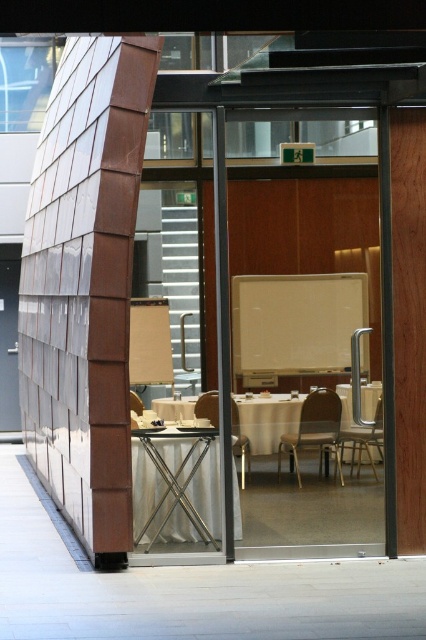
Question: Based on their relative distances, which object is farther from the matte brown chair at center?

Choices:
 (A) white fabric table at center
 (B) brown leather chair at center
 (C) metallic gold chair at center-right
 (D) metallic silver chair at center

Answer: (C)

Question: Does metallic silver table at lower center have a lesser width compared to white fabric table at center?

Choices:
 (A) yes
 (B) no

Answer: (B)

Question: Which point is closer to the camera?

Choices:
 (A) metallic gold chair at center-right
 (B) transparent glass door at center
 (C) white fabric table at center
 (D) metallic silver chair at center

Answer: (A)

Question: Which of the following is the farthest from the observer?

Choices:
 (A) (345, 396)
 (B) (239, 534)
 (C) (132, 404)

Answer: (C)

Question: Does white fabric table at center have a larger size compared to metallic silver chair at center?

Choices:
 (A) no
 (B) yes

Answer: (A)

Question: Is metallic gold chair at center-right to the right of matte brown chair at center from the viewer's perspective?

Choices:
 (A) no
 (B) yes

Answer: (B)